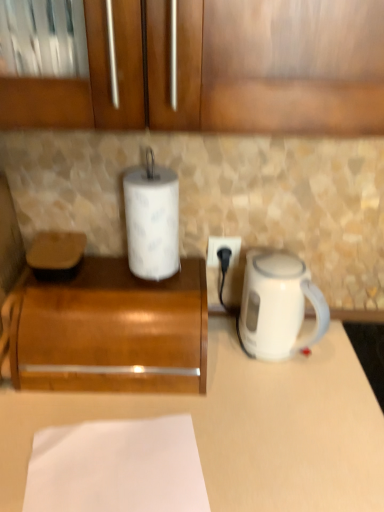
Where is `vacant area situated below white paper at lower center (from a real-world perspective)`? vacant area situated below white paper at lower center (from a real-world perspective) is located at coordinates point(120,472).